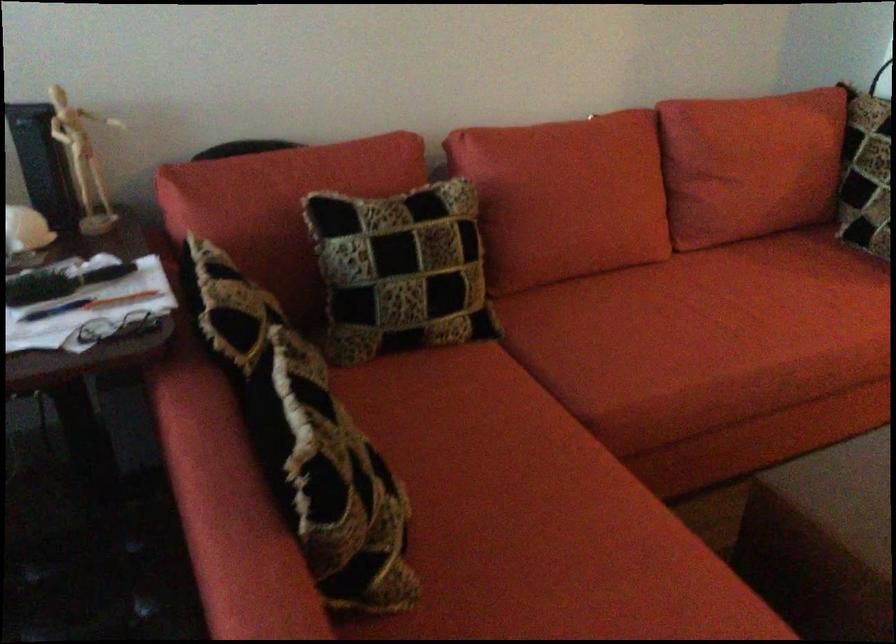
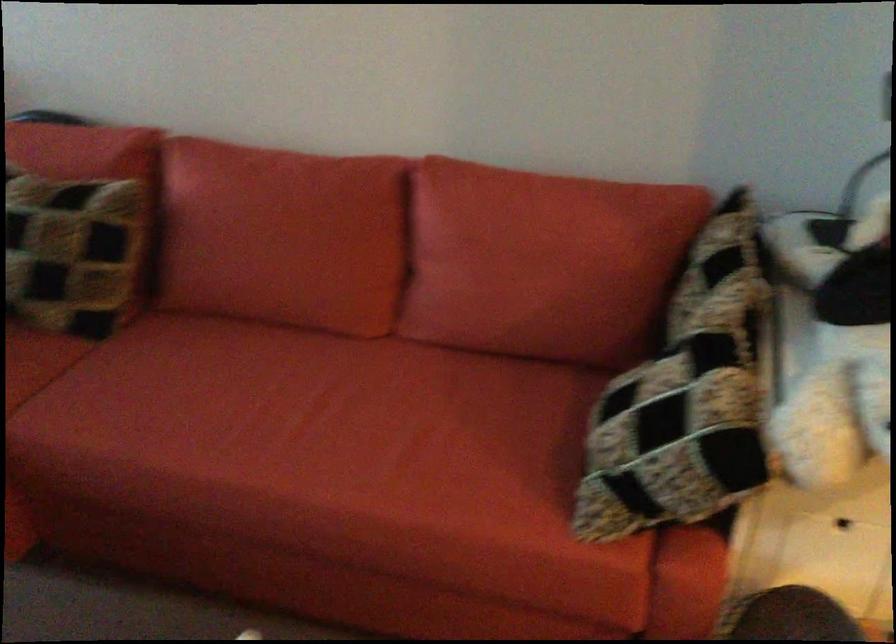
Where in the second image is the point corresponding to pixel 789 158 from the first image?

(538, 270)